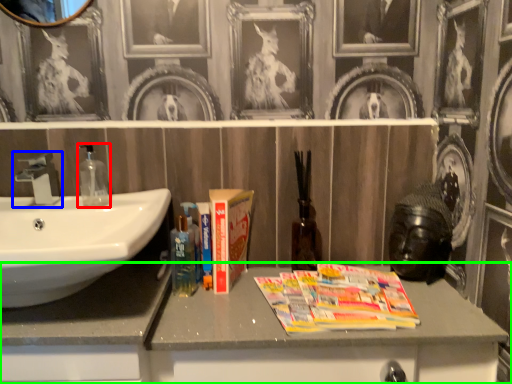
Question: Based on their relative distances, which object is nearer to soap dispenser (highlighted by a red box)? Choose from tap (highlighted by a blue box) and bathroom cabinet (highlighted by a green box).

Choices:
 (A) tap
 (B) bathroom cabinet

Answer: (A)